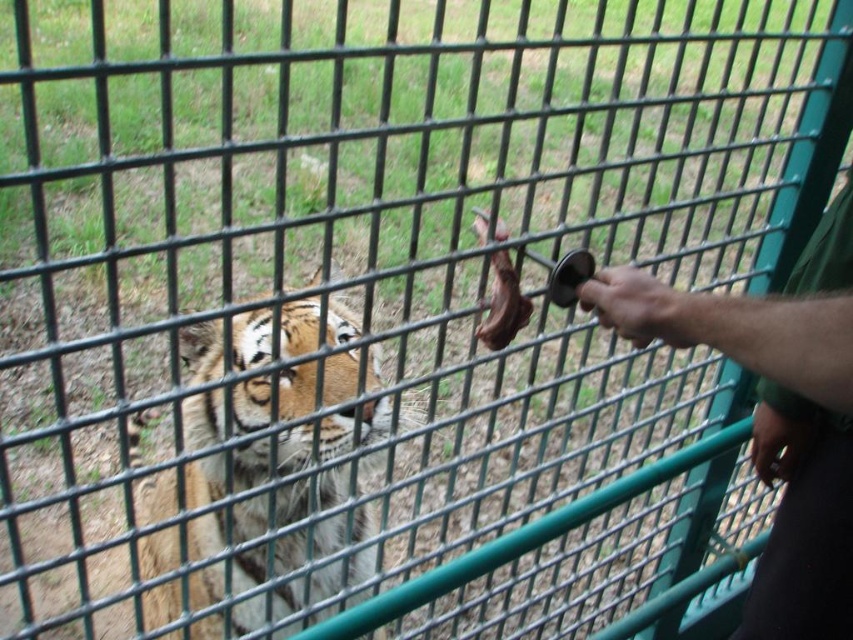
Does smooth skin hand at center right have a lesser height compared to smooth skin hand at lower right?

Correct, smooth skin hand at center right is not as tall as smooth skin hand at lower right.

The width and height of the screenshot is (853, 640). Describe the element at coordinates (640, 307) in the screenshot. I see `smooth skin hand at center right` at that location.

This screenshot has height=640, width=853. I want to click on smooth skin hand at center right, so click(x=640, y=307).

Who is higher up, green fabric shirt at right or smooth skin hand at center right?

smooth skin hand at center right

Can you confirm if green fabric shirt at right is positioned to the left of smooth skin hand at center right?

Incorrect, green fabric shirt at right is not on the left side of smooth skin hand at center right.

Which is in front, point (785, 346) or point (614, 330)?

Point (785, 346)

In order to click on green fabric shirt at right in this screenshot , I will do `click(776, 410)`.

Consider the image. Who is positioned more to the left, orange fur tiger at center or smooth skin hand at center right?

From the viewer's perspective, orange fur tiger at center appears more on the left side.

Is point (311, 392) positioned before point (645, 307)?

No, it is not.

Is point (303, 307) positioned before point (633, 272)?

No, (303, 307) is behind (633, 272).

At what (x,y) coordinates should I click in order to perform the action: click on orange fur tiger at center. Please return your answer as a coordinate pair (x, y). Looking at the image, I should click on (282, 476).